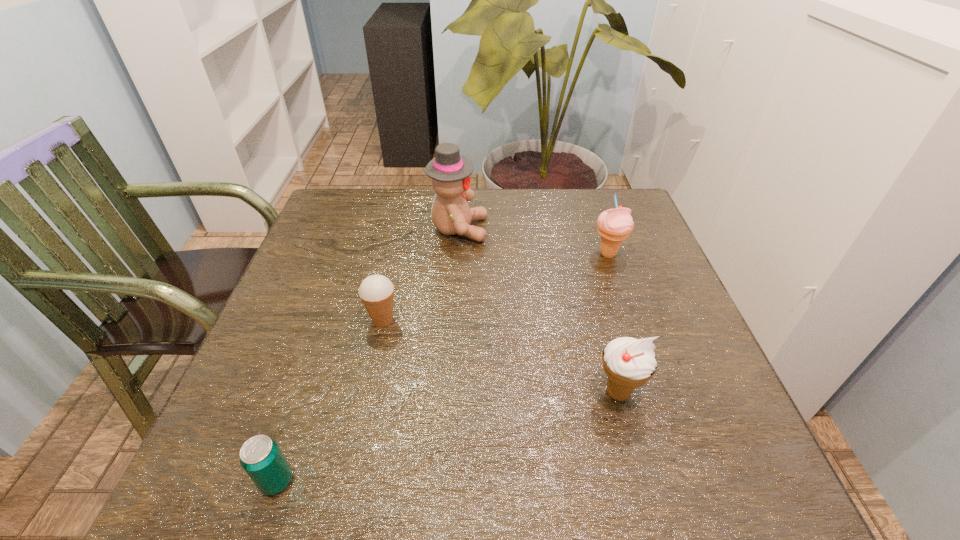
I want to click on the tallest object, so click(x=450, y=172).

Image resolution: width=960 pixels, height=540 pixels. Find the location of `the third object from left to right`. the third object from left to right is located at coordinates (450, 172).

Find the location of `the nearest icecream`. the nearest icecream is located at coordinates (628, 362).

At what (x,y) coordinates should I click in order to perform the action: click on the farthest icecream. Please return your answer as a coordinate pair (x, y). This screenshot has height=540, width=960. Looking at the image, I should click on (614, 225).

This screenshot has height=540, width=960. Identify the location of the second farthest icecream. (376, 291).

Where is `the third farthest object`? This screenshot has height=540, width=960. the third farthest object is located at coordinates (376, 291).

Identify the location of the nearest object. This screenshot has width=960, height=540. (262, 459).

Find the location of `the leftmost object`. the leftmost object is located at coordinates (262, 459).

Locate an element on the screen. This screenshot has width=960, height=540. free space located on the front-facing side of the third object from left to right is located at coordinates (587, 229).

Image resolution: width=960 pixels, height=540 pixels. I want to click on vacant space located 0.130m on the right of the nearest icecream, so 712,392.